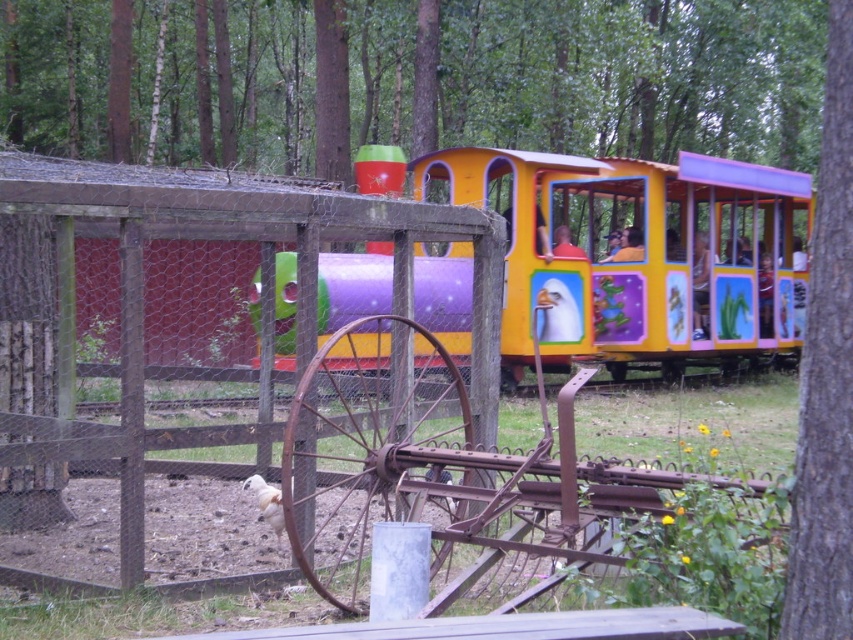
Which is below, matte plastic train at center or green leafy tree at right?

Positioned lower is green leafy tree at right.

You are a GUI agent. You are given a task and a screenshot of the screen. Output one action in this format:
    pyautogui.click(x=<x>, y=<y>)
    Task: Click on the matte plastic train at center
    The width and height of the screenshot is (853, 640).
    Given the screenshot: What is the action you would take?
    pyautogui.click(x=639, y=253)

Find the location of a particular element. The width and height of the screenshot is (853, 640). matte plastic train at center is located at coordinates pyautogui.click(x=639, y=253).

I want to click on matte plastic train at center, so click(639, 253).